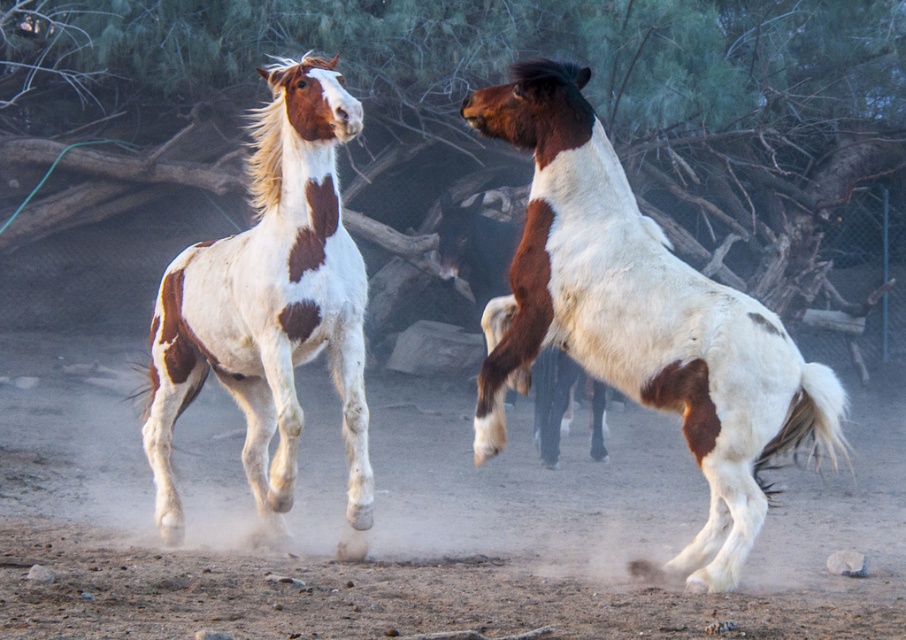
The width and height of the screenshot is (906, 640). I want to click on white-brown speckled horse at center, so click(641, 321).

Does white-brown speckled horse at center have a lesser width compared to brown and white speckled horse at right?

No.

Who is more forward, (643, 227) or (480, 237)?

Point (643, 227) is more forward.

This screenshot has width=906, height=640. Find the location of `white-brown speckled horse at center`. white-brown speckled horse at center is located at coordinates (641, 321).

This screenshot has height=640, width=906. Find the location of `white-brown speckled horse at center`. white-brown speckled horse at center is located at coordinates (641, 321).

Does white speckled horse at left appear on the left side of brown and white speckled horse at right?

Indeed, white speckled horse at left is positioned on the left side of brown and white speckled horse at right.

Describe the element at coordinates (268, 304) in the screenshot. I see `white speckled horse at left` at that location.

Locate an element on the screen. white speckled horse at left is located at coordinates (268, 304).